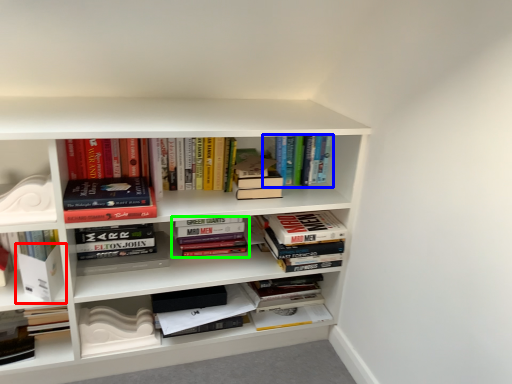
Question: Considering the real-world distances, which object is closest to paperback book (highlighted by a red box)? book (highlighted by a blue box) or book (highlighted by a green box).

Choices:
 (A) book
 (B) book

Answer: (B)